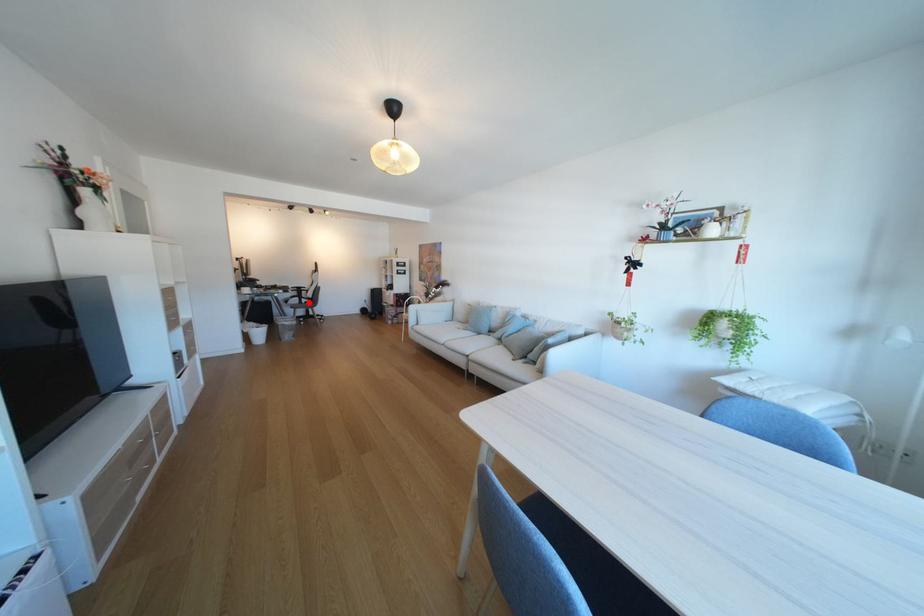
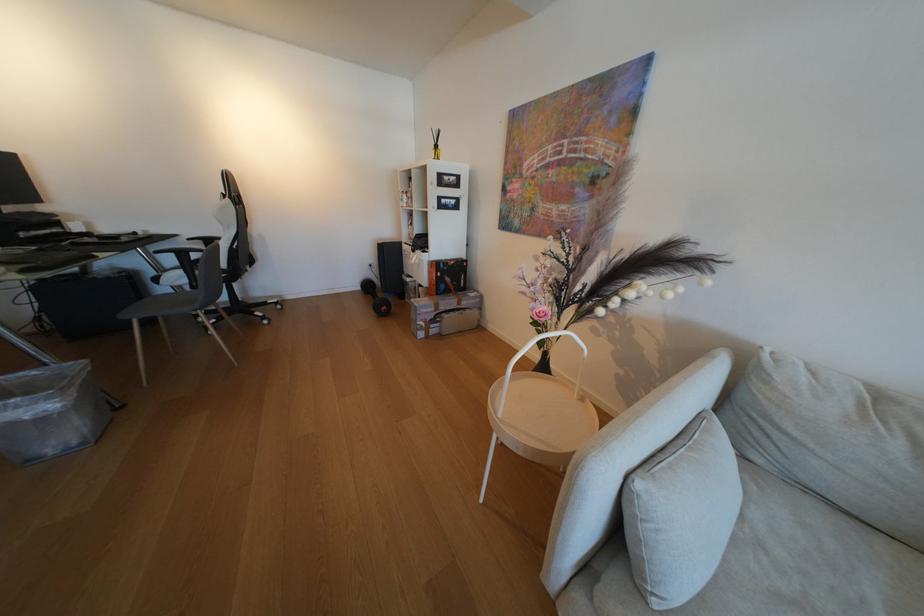
In the second image, find the point that corresponds to the highlighted location in the first image.

(196, 282)